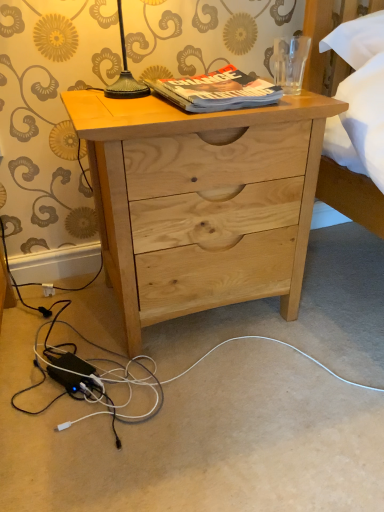
The height and width of the screenshot is (512, 384). I want to click on natural wood nightstand at center, so click(200, 201).

What do you see at coordinates (200, 201) in the screenshot? The image size is (384, 512). I see `natural wood nightstand at center` at bounding box center [200, 201].

This screenshot has height=512, width=384. Describe the element at coordinates (217, 91) in the screenshot. I see `hardcover book at upper center` at that location.

What is the approximate height of hardcover book at upper center?

hardcover book at upper center is 5.50 centimeters in height.

What is the approximate width of hardcover book at upper center?

hardcover book at upper center is 11.71 inches in width.

The height and width of the screenshot is (512, 384). Find the location of `hardcover book at upper center`. hardcover book at upper center is located at coordinates (217, 91).

This screenshot has height=512, width=384. What are the coordinates of `natural wood nightstand at center` in the screenshot? It's located at (200, 201).

Does natural wood nightstand at center appear on the left side of hardcover book at upper center?

Yes.

Is natural wood nightstand at center in front of or behind hardcover book at upper center in the image?

natural wood nightstand at center is positioned closer to the viewer than hardcover book at upper center.

Does point (83, 112) appear closer or farther from the camera than point (210, 76)?

Clearly, point (83, 112) is closer to the camera than point (210, 76).

From the image's perspective, is natural wood nightstand at center located above hardcover book at upper center?

Actually, natural wood nightstand at center appears below hardcover book at upper center in the image.

From a real-world perspective, which object rests below the other?

From a 3D spatial view, natural wood nightstand at center is below.

Is natural wood nightstand at center wider than hardcover book at upper center?

Indeed, natural wood nightstand at center has a greater width compared to hardcover book at upper center.

Considering the sizes of natural wood nightstand at center and hardcover book at upper center in the image, is natural wood nightstand at center taller or shorter than hardcover book at upper center?

Considering their sizes, natural wood nightstand at center has more height than hardcover book at upper center.

Looking at this image, can you confirm if natural wood nightstand at center is bigger than hardcover book at upper center?

Yes.

Can we say natural wood nightstand at center lies outside hardcover book at upper center?

Yes, natural wood nightstand at center is not within hardcover book at upper center.

Is natural wood nightstand at center far from hardcover book at upper center?

No, there isn't a large distance between natural wood nightstand at center and hardcover book at upper center.

From the picture: Is natural wood nightstand at center facing towards hardcover book at upper center?

No, natural wood nightstand at center is not facing towards hardcover book at upper center.

What's the angular difference between natural wood nightstand at center and hardcover book at upper center's facing directions?

They differ by 1.25 degrees in their facing directions.

How much distance is there between natural wood nightstand at center and hardcover book at upper center?

natural wood nightstand at center and hardcover book at upper center are 8.48 inches apart.

Image resolution: width=384 pixels, height=512 pixels. Identify the location of desk on the left of the hardcover book at upper center. (200, 201).

Is hardcover book at upper center to the left of natural wood nightstand at center from the viewer's perspective?

No, hardcover book at upper center is not to the left of natural wood nightstand at center.

Considering the positions of objects hardcover book at upper center and natural wood nightstand at center in the image provided, who is in front, hardcover book at upper center or natural wood nightstand at center?

natural wood nightstand at center is in front.

Considering the positions of points (155, 87) and (141, 185), is point (155, 87) farther from camera compared to point (141, 185)?

That is True.

From the image's perspective, which object appears higher, hardcover book at upper center or natural wood nightstand at center?

hardcover book at upper center appears higher in the image.

From a real-world perspective, is hardcover book at upper center over natural wood nightstand at center?

Yes, from a real-world perspective, hardcover book at upper center is above natural wood nightstand at center.

Consider the image. Considering the relative sizes of hardcover book at upper center and natural wood nightstand at center in the image provided, is hardcover book at upper center wider than natural wood nightstand at center?

No, hardcover book at upper center is not wider than natural wood nightstand at center.

From the picture: Considering the sizes of hardcover book at upper center and natural wood nightstand at center in the image, is hardcover book at upper center taller or shorter than natural wood nightstand at center?

In the image, hardcover book at upper center appears to be shorter than natural wood nightstand at center.

Which of these two, hardcover book at upper center or natural wood nightstand at center, is bigger?

natural wood nightstand at center.

Is natural wood nightstand at center completely or partially inside hardcover book at upper center?

No, natural wood nightstand at center is located outside of hardcover book at upper center.

From the picture: Is hardcover book at upper center far from natural wood nightstand at center?

No, hardcover book at upper center is not far from natural wood nightstand at center.

Does hardcover book at upper center turn towards natural wood nightstand at center?

No, hardcover book at upper center is not turned towards natural wood nightstand at center.

Measure the distance between hardcover book at upper center and natural wood nightstand at center.

hardcover book at upper center is 8.48 inches away from natural wood nightstand at center.

This screenshot has width=384, height=512. What are the coordinates of `book above the natural wood nightstand at center (from a real-world perspective)` in the screenshot? It's located at (217, 91).

The width and height of the screenshot is (384, 512). What are the coordinates of `book above the natural wood nightstand at center (from the image's perspective)` in the screenshot? It's located at (217, 91).

Locate an element on the screen. This screenshot has height=512, width=384. desk lying on the left of hardcover book at upper center is located at coordinates (200, 201).